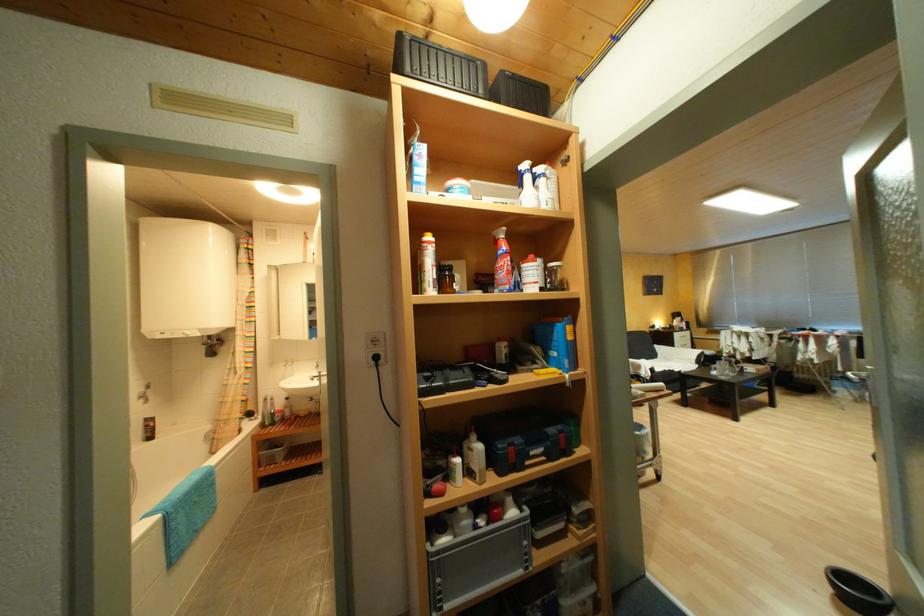
Find where to turn the silver microwave knob. Please return your answer as a coordinate pair (x, y).

(212, 344)